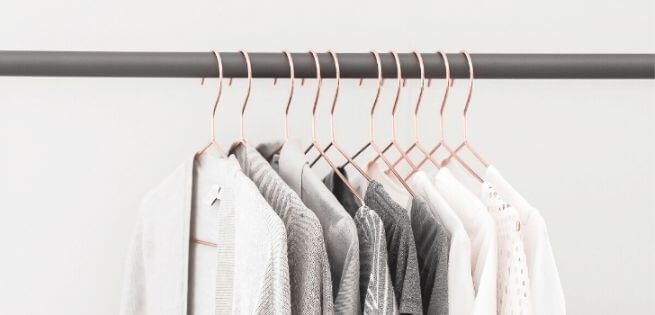
At what (x,y) coordinates should I click in order to perform the action: click on hangers. Please return your answer as a coordinate pair (x, y). The width and height of the screenshot is (655, 315). Looking at the image, I should click on pos(214,118), pos(242,129), pos(286,124), pos(314,126), pos(333,130), pos(371,134), pos(394,136), pos(417,136), pos(441,138), pos(464,135).